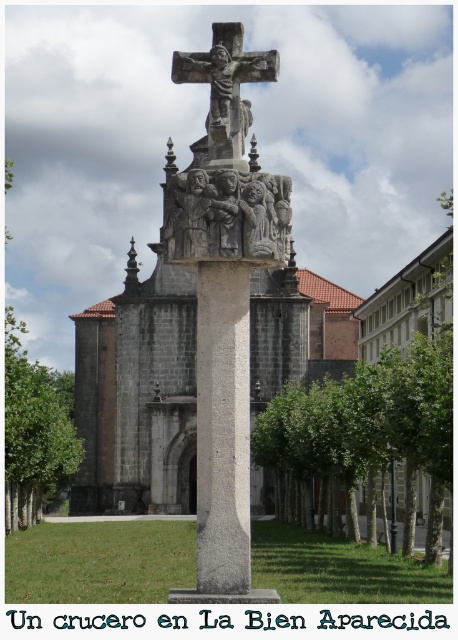
Question: Among these points, which one is farthest from the camera?

Choices:
 (A) (263, 173)
 (B) (221, 186)
 (C) (172, 196)

Answer: (C)

Question: Considering the relative positions of carved stone relief at center and matte stone carving at center in the image provided, where is carved stone relief at center located with respect to matte stone carving at center?

Choices:
 (A) right
 (B) left

Answer: (B)

Question: Is carved stone relief at center in front of matte stone carving at center?

Choices:
 (A) yes
 (B) no

Answer: (A)

Question: Is matte stone statue at center smaller than polished stone crucifix at center?

Choices:
 (A) yes
 (B) no

Answer: (A)

Question: Among these points, which one is farthest from the camera?

Choices:
 (A) (190, 198)
 (B) (213, 88)
 (C) (247, 218)
 (D) (239, 216)

Answer: (B)

Question: Which point is closer to the camera taking this photo?

Choices:
 (A) (267, 256)
 (B) (225, 113)
 (C) (236, 237)

Answer: (C)